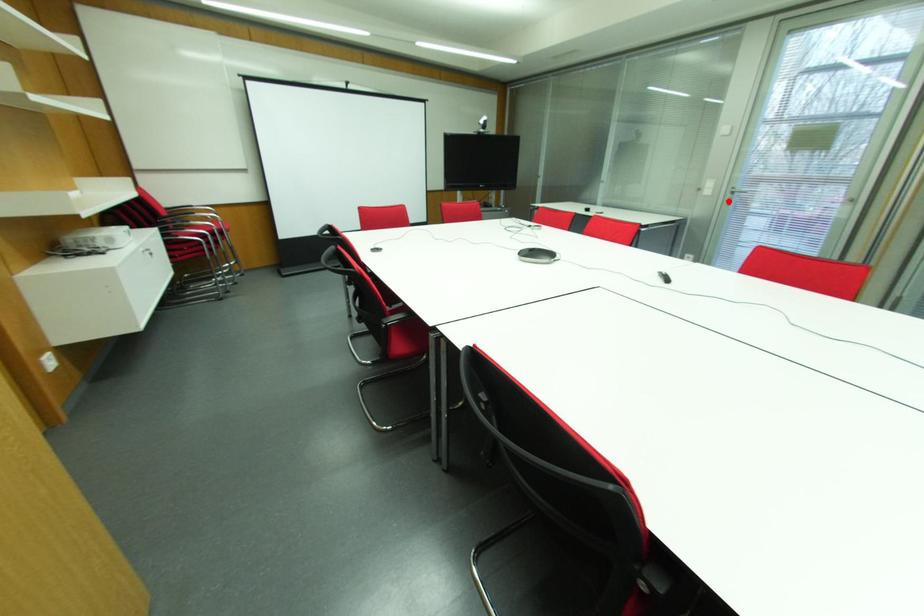
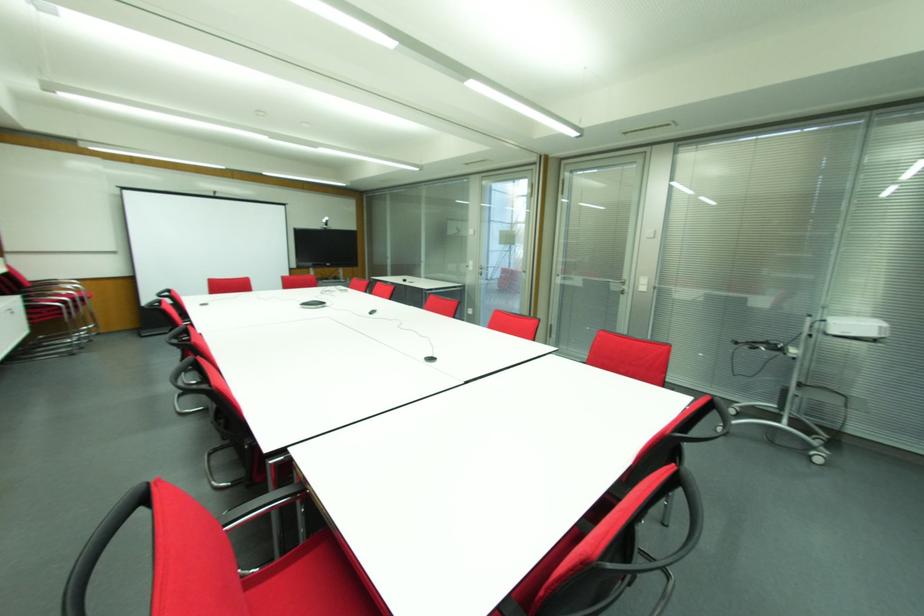
Question: A red point is marked in image1. In image2, is the corresponding 3D point closer to the camera or farther? Reply with the corresponding letter.

Choices:
 (A) The corresponding 3D point is closer.
 (B) The corresponding 3D point is farther.

Answer: (A)